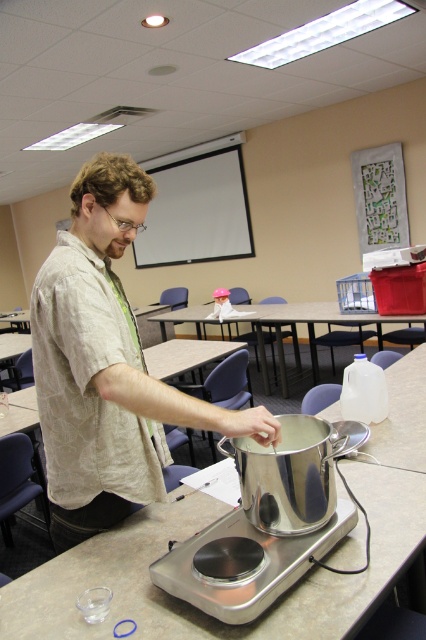
Question: Is silver metallic table at center thinner than metallic table at center?

Choices:
 (A) no
 (B) yes

Answer: (B)

Question: Which of the following is the farthest from the observer?

Choices:
 (A) matte beige shirt at center
 (B) metallic table at center
 (C) silver metallic table at center

Answer: (B)

Question: Which of the following is the farthest from the observer?

Choices:
 (A) silver metallic table at center
 (B) matte beige shirt at center
 (C) metallic table at center

Answer: (C)

Question: Which of the following is the farthest from the observer?

Choices:
 (A) matte beige shirt at center
 (B) metallic table at center

Answer: (B)

Question: Is matte beige shirt at center positioned in front of silver metallic table at center?

Choices:
 (A) yes
 (B) no

Answer: (B)

Question: Is matte beige shirt at center further to the viewer compared to metallic table at center?

Choices:
 (A) yes
 (B) no

Answer: (B)